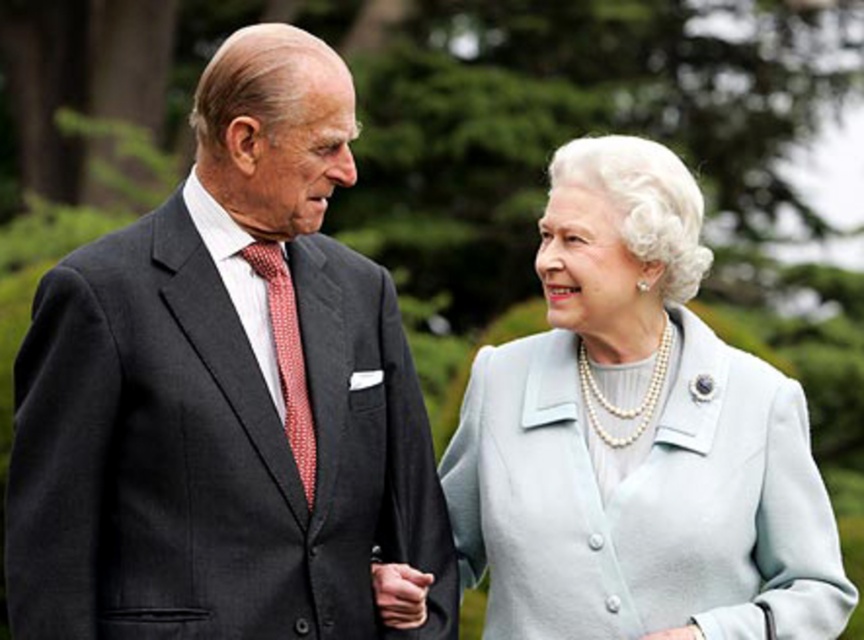
You are standing in a garden where two people are talking. There are two points marked in the image. The first point is at coordinates point (248,570) and the second is at point (780,604). Which point is closer to you?

Point (248,570) is in front of point (780,604), so it is closer to you.

You are a tailor who needs to determine which garment requires more fabric for alterations. Based on the image, which one is wider between the dark gray suit at left and the light blue fabric coat at center?

The dark gray suit at left is wider than the light blue fabric coat at center, so it requires more fabric for alterations.